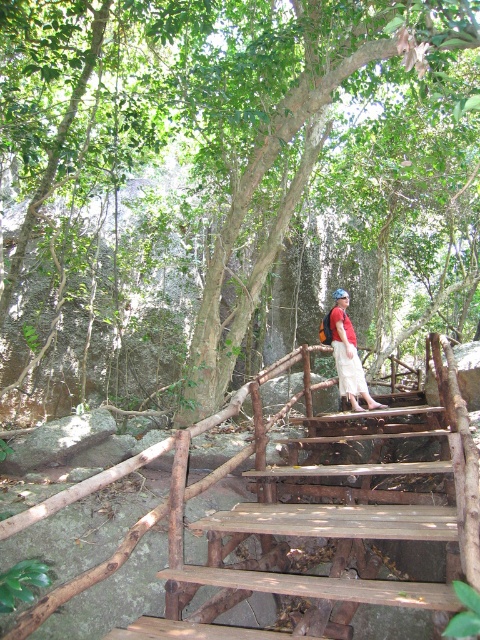
You are standing at the base of the wooden staircase in the forest. You notice a specific point marked at coordinates (230, 172). Which object in the scene does this point belong to?

The point at (230, 172) is on the green leafy tree at center.

You are standing at the bottom of the wooden staircase in the forest. You see a green leafy tree at center and a matte red shirt at center. Which object is closer to you? Please explain your reasoning based on the scene description.

The green leafy tree at center and matte red shirt at center are 4.80 meters apart. However, the description does not specify which one is closer to you. Therefore, it is impossible to determine which object is closer based on the provided information.

You are standing on the path and see the rusty wood stairs at center and the matte red shirt at center. Which object is located to the right side?

The matte red shirt at center is located to the right side of the rusty wood stairs at center.